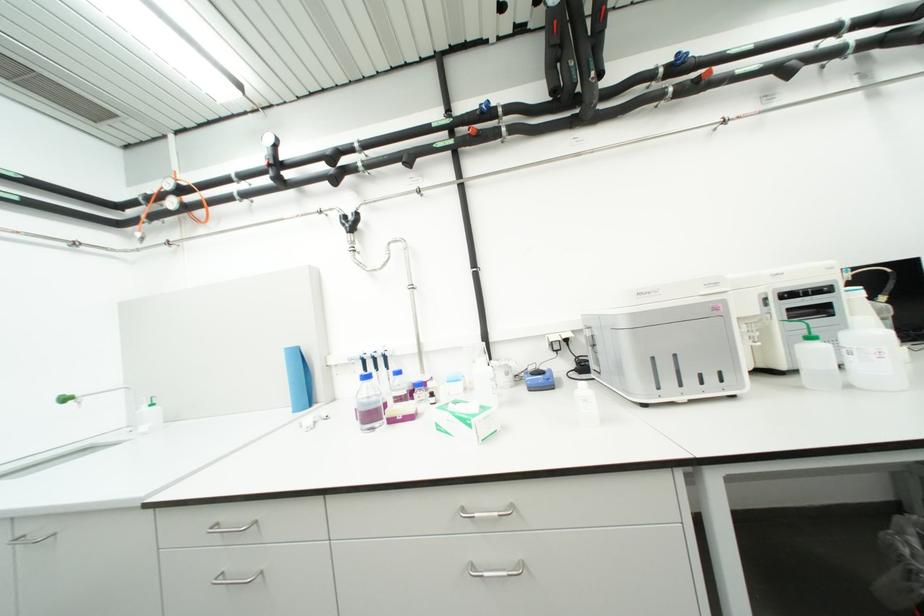
Find where to open the clear plastic bottle. Please return your answer as a coordinate pair (x, y).

(369, 403)